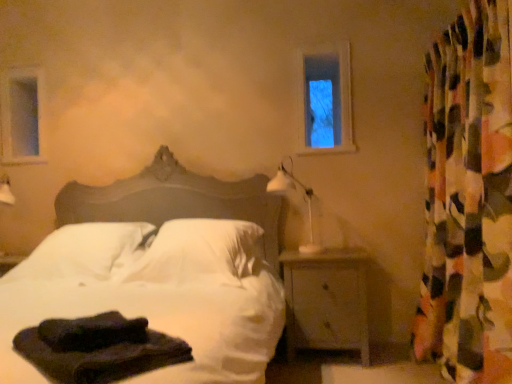
Measure the distance between point (343, 70) and camera.

A distance of 2.90 meters exists between point (343, 70) and camera.

This screenshot has width=512, height=384. I want to click on clear glass window at upper left, which appears as the 2th window frame when viewed from the right, so click(22, 117).

Describe the element at coordinates (98, 349) in the screenshot. I see `dark fabric at lower left, which is the first material in bottom-to-top order` at that location.

Where is `multicolored fabric curtain at right`? multicolored fabric curtain at right is located at coordinates (468, 200).

Identify the location of dark fabric at lower left, the 2th material in the bottom-to-top sequence. (92, 332).

The image size is (512, 384). I want to click on clear glass window at upper center, acting as the first window frame starting from the right, so click(x=325, y=101).

From a real-world perspective, is white plastic table lamp at center right on white soft bed at center?

Correct, in the physical world, white plastic table lamp at center right is higher than white soft bed at center.

Does point (292, 186) come farther from viewer compared to point (26, 278)?

Yes.

From the image's perspective, who appears lower, white plastic table lamp at center right or white soft bed at center?

white soft bed at center.

Is there a large distance between white plastic table lamp at center right and white soft bed at center?

white plastic table lamp at center right is near white soft bed at center, not far away.

In the scene shown: Measure the distance between dark fabric at lower left, the 2th material in the bottom-to-top sequence, and wooden nightstand at lower right.

The distance of dark fabric at lower left, the 2th material in the bottom-to-top sequence, from wooden nightstand at lower right is 1.49 meters.

Is dark fabric at lower left, the first material from the top, directly adjacent to wooden nightstand at lower right?

No, dark fabric at lower left, the first material from the top, is not making contact with wooden nightstand at lower right.

Is dark fabric at lower left, the 2th material in the bottom-to-top sequence, looking in the opposite direction of wooden nightstand at lower right?

dark fabric at lower left, the 2th material in the bottom-to-top sequence, is not turned away from wooden nightstand at lower right.

From the image's perspective, does dark fabric at lower left, the 2th material in the bottom-to-top sequence, appear higher than wooden nightstand at lower right?

Yes.

Can you tell me how much white soft pillow at center, the 2th pillow positioned from the right, and multicolored fabric curtain at right differ in facing direction?

The angular difference between white soft pillow at center, the 2th pillow positioned from the right, and multicolored fabric curtain at right is 87.3 degrees.

Is white soft pillow at center, the 2th pillow positioned from the right, not near multicolored fabric curtain at right?

Yes.

Between white soft pillow at center, arranged as the 1th pillow when viewed from the left, and multicolored fabric curtain at right, which one has larger width?

Wider between the two is white soft pillow at center, arranged as the 1th pillow when viewed from the left.

Can you confirm if white soft pillow at center, the 2th pillow positioned from the right, is shorter than multicolored fabric curtain at right?

Yes.

Considering the sizes of objects dark fabric at lower left, which is the first material in bottom-to-top order, and clear glass window at upper center, acting as the first window frame starting from the right, in the image provided, who is wider, dark fabric at lower left, which is the first material in bottom-to-top order, or clear glass window at upper center, acting as the first window frame starting from the right,?

dark fabric at lower left, which is the first material in bottom-to-top order, is wider.

Is dark fabric at lower left, the 2th material when ordered from top to bottom, oriented away from clear glass window at upper center, arranged as the first window frame when viewed from the front?

No, dark fabric at lower left, the 2th material when ordered from top to bottom, is not facing the opposite direction of clear glass window at upper center, arranged as the first window frame when viewed from the front.

In terms of size, does dark fabric at lower left, which is the first material in bottom-to-top order, appear bigger or smaller than clear glass window at upper center, arranged as the first window frame when viewed from the front?

Considering their sizes, dark fabric at lower left, which is the first material in bottom-to-top order, takes up more space than clear glass window at upper center, arranged as the first window frame when viewed from the front.

Which of these two, dark fabric at lower left, the 2th material when ordered from top to bottom, or clear glass window at upper center, acting as the second window frame starting from the back, stands shorter?

dark fabric at lower left, the 2th material when ordered from top to bottom, is shorter.

Can you confirm if white soft bed at center is bigger than clear glass window at upper left, the 1th window frame viewed from the left?

Indeed, white soft bed at center has a larger size compared to clear glass window at upper left, the 1th window frame viewed from the left.

Can clear glass window at upper left, marked as the second window frame in a front-to-back arrangement, be found inside white soft bed at center?

Definitely not — clear glass window at upper left, marked as the second window frame in a front-to-back arrangement, is not inside white soft bed at center.

Could you tell me if white soft bed at center is facing clear glass window at upper left, arranged as the first window frame when viewed from the back?

No, white soft bed at center is not aimed at clear glass window at upper left, arranged as the first window frame when viewed from the back.

Where is `window frame on the left of white soft bed at center`? This screenshot has width=512, height=384. window frame on the left of white soft bed at center is located at coordinates (22, 117).

Is white plastic table lamp at center right in contact with dark fabric at lower left, which is the first material in bottom-to-top order?

white plastic table lamp at center right and dark fabric at lower left, which is the first material in bottom-to-top order, are not in contact.

From their relative heights in the image, would you say white plastic table lamp at center right is taller or shorter than dark fabric at lower left, which is the first material in bottom-to-top order?

Considering their sizes, white plastic table lamp at center right has more height than dark fabric at lower left, which is the first material in bottom-to-top order.

Is white plastic table lamp at center right to the left of dark fabric at lower left, which is the first material in bottom-to-top order, from the viewer's perspective?

No, white plastic table lamp at center right is not to the left of dark fabric at lower left, which is the first material in bottom-to-top order.

Between white plastic table lamp at center right and dark fabric at lower left, which is the first material in bottom-to-top order, which one is positioned behind?

white plastic table lamp at center right.

In the scene shown: From the image's perspective, is white plastic table lamp at center right located beneath white soft pillow at center, the 2th pillow positioned from the right?

No.

Who is smaller, white plastic table lamp at center right or white soft pillow at center, the 2th pillow positioned from the right?

white plastic table lamp at center right.

From a real-world perspective, who is located lower, white plastic table lamp at center right or white soft pillow at center, arranged as the 1th pillow when viewed from the left?

white soft pillow at center, arranged as the 1th pillow when viewed from the left, from a real-world perspective.

Where is `bed located on the left of white plastic table lamp at center right`? This screenshot has width=512, height=384. bed located on the left of white plastic table lamp at center right is located at coordinates (161, 270).

Where is `nightstand on the right of dark fabric at lower left, the 2th material in the bottom-to-top sequence`? The height and width of the screenshot is (384, 512). nightstand on the right of dark fabric at lower left, the 2th material in the bottom-to-top sequence is located at coordinates (326, 300).

Estimate the real-world distances between objects in this image. Which object is closer to white soft bed at center, white soft pillow at center, which appears as the 2th pillow when viewed from the left, or white soft pillow at center, arranged as the 1th pillow when viewed from the left?

Among the two, white soft pillow at center, which appears as the 2th pillow when viewed from the left, is located nearer to white soft bed at center.

Estimate the real-world distances between objects in this image. Which object is further from multicolored fabric curtain at right, dark fabric at lower left, the first material from the top, or white soft pillow at center, the 1th pillow when ordered from right to left?

The object further to multicolored fabric curtain at right is dark fabric at lower left, the first material from the top.

Considering their positions, is dark fabric at lower left, the 2th material in the bottom-to-top sequence, positioned further to multicolored fabric curtain at right than clear glass window at upper center, arranged as the first window frame when viewed from the front?

dark fabric at lower left, the 2th material in the bottom-to-top sequence, is further to multicolored fabric curtain at right.

When comparing their distances from wooden nightstand at lower right, does multicolored fabric curtain at right or clear glass window at upper left, marked as the second window frame in a front-to-back arrangement, seem further?

clear glass window at upper left, marked as the second window frame in a front-to-back arrangement, lies further to wooden nightstand at lower right than the other object.

Based on their spatial positions, is white soft pillow at center, arranged as the 1th pillow when viewed from the left, or dark fabric at lower left, the first material from the top, closer to dark fabric at lower left, which is the first material in bottom-to-top order?

dark fabric at lower left, the first material from the top, is positioned closer to the anchor dark fabric at lower left, which is the first material in bottom-to-top order.

Which object lies further to the anchor point white soft pillow at center, arranged as the 1th pillow when viewed from the left, clear glass window at upper center, acting as the first window frame starting from the right, or clear glass window at upper left, which appears as the 2th window frame when viewed from the right?

Among the two, clear glass window at upper center, acting as the first window frame starting from the right, is located further to white soft pillow at center, arranged as the 1th pillow when viewed from the left.

Estimate the real-world distances between objects in this image. Which object is further from white soft bed at center, clear glass window at upper center, acting as the first window frame starting from the right, or dark fabric at lower left, which is the first material in bottom-to-top order?

clear glass window at upper center, acting as the first window frame starting from the right, is positioned further to the anchor white soft bed at center.

When comparing their distances from multicolored fabric curtain at right, does dark fabric at lower left, which is the first material in bottom-to-top order, or wooden nightstand at lower right seem closer?

wooden nightstand at lower right is closer to multicolored fabric curtain at right.

Locate an element on the screen. The height and width of the screenshot is (384, 512). table lamp between clear glass window at upper left, arranged as the first window frame when viewed from the back, and multicolored fabric curtain at right, in the horizontal direction is located at coordinates (305, 200).

At what (x,y) coordinates should I click in order to perform the action: click on pillow between white soft bed at center and white soft pillow at center, the 2th pillow positioned from the right, from front to back. Please return your answer as a coordinate pair (x, y). This screenshot has width=512, height=384. Looking at the image, I should click on (200, 253).

At what (x,y) coordinates should I click in order to perform the action: click on pillow between dark fabric at lower left, the 2th material in the bottom-to-top sequence, and multicolored fabric curtain at right, in the horizontal direction. Please return your answer as a coordinate pair (x, y). Looking at the image, I should click on (200, 253).

This screenshot has width=512, height=384. In order to click on nightstand positioned between dark fabric at lower left, the 2th material in the bottom-to-top sequence, and clear glass window at upper center, placed as the 2th window frame when sorted from left to right, from near to far in this screenshot , I will do `click(326, 300)`.